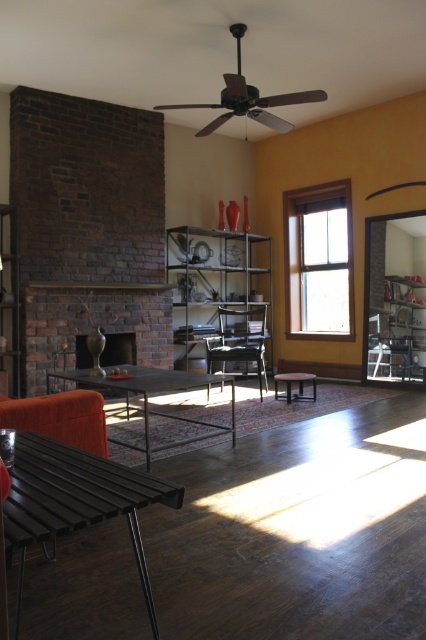
You are planning to rearrange the living room and want to move the metallic silver chair at right closer to the fireplace. However, you need to ensure there is enough space between it and the wooden stool at center. Based on their sizes, do you think this arrangement is feasible?

The metallic silver chair at right occupies less space than the wooden stool at center, so moving it closer to the fireplace while maintaining enough space between them should be feasible as the chair takes up less area.

You are a delivery person who needs to place a package between the metallic silver chair at right and the wooden stool at center. The package is 3 feet long. Can you fit it between them?

The metallic silver chair at right and wooden stool at center are 3.62 feet apart from each other. Since the package is 3 feet long, it can fit between them as the distance is sufficient.

You are arranging a living room and want to place a new sofa. You see the brick fireplace at center and the matte brown vase at left. Which object is positioned higher in the room?

The brick fireplace at center is positioned higher than the matte brown vase at left.